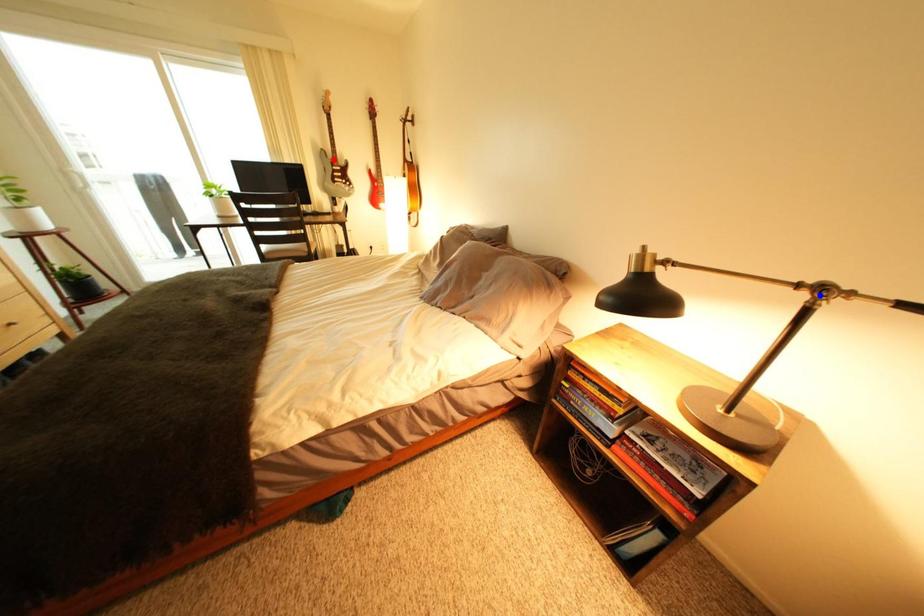
Question: Two points are marked on the image. Which point is closer to the camera?

Choices:
 (A) Blue point is closer.
 (B) Red point is closer.

Answer: (A)